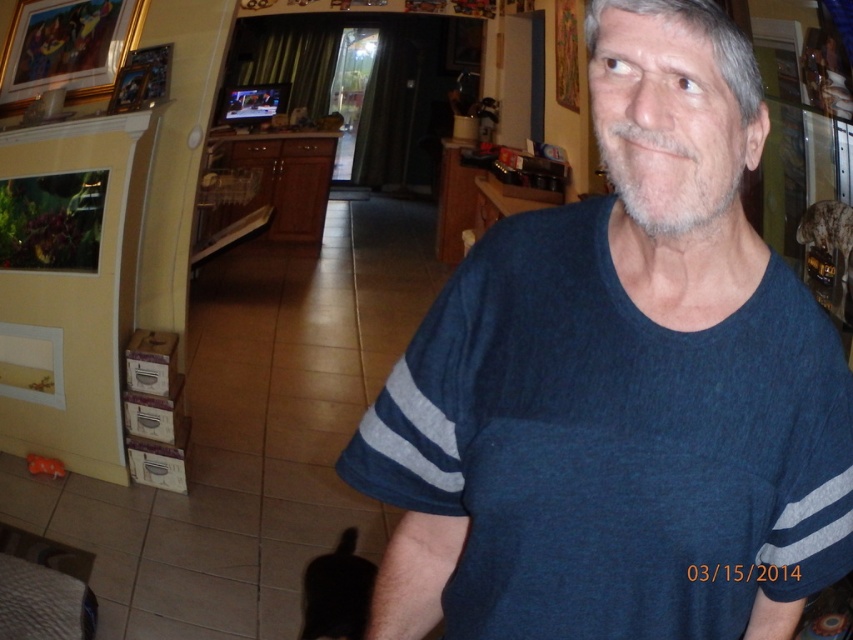
Does blue heathered t-shirt at center come behind matte plastic bag at lower left?

No, blue heathered t-shirt at center is closer to the viewer.

Can you confirm if blue heathered t-shirt at center is positioned below matte plastic bag at lower left?

Actually, blue heathered t-shirt at center is above matte plastic bag at lower left.

Is point (485, 240) closer to viewer compared to point (86, 625)?

Yes.

Image resolution: width=853 pixels, height=640 pixels. In order to click on blue heathered t-shirt at center in this screenshot , I will do `click(613, 444)`.